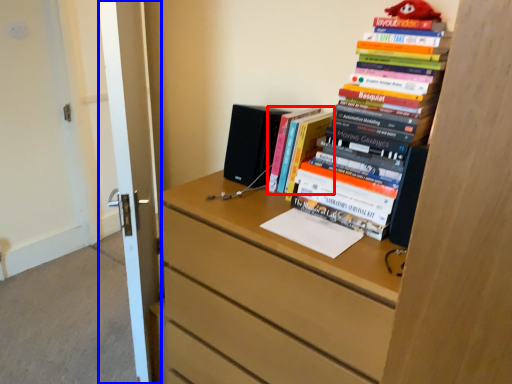
Question: Which point is further to the camera, book (highlighted by a red box) or door (highlighted by a blue box)?

Choices:
 (A) book
 (B) door

Answer: (A)